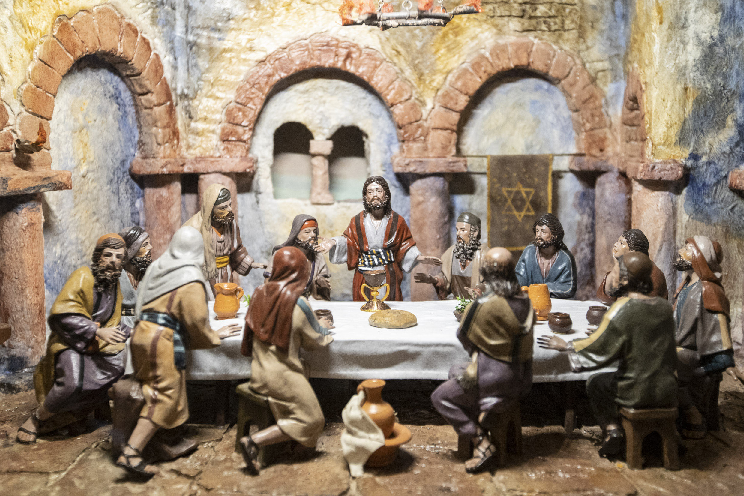
The image size is (744, 496). Find the location of `curve of an arch`. curve of an arch is located at coordinates (291, 122), (353, 126), (97, 51), (324, 68), (513, 68), (515, 36), (324, 33), (92, 8).